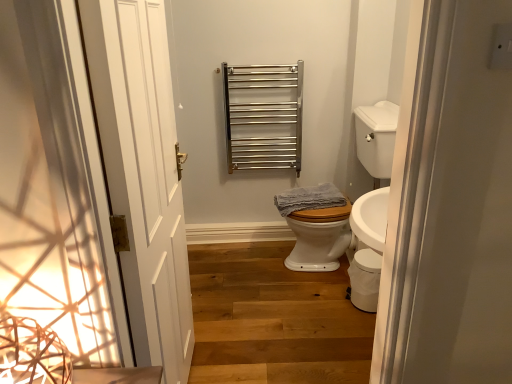
Locate an element on the screen. The image size is (512, 384). vacant space positioned to the left of white glossy sink at right is located at coordinates coord(246,274).